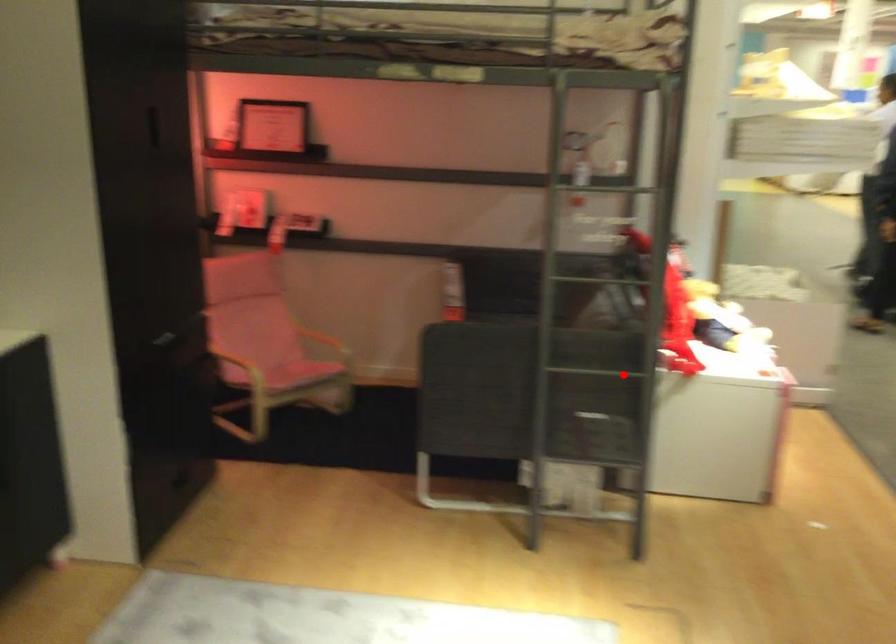
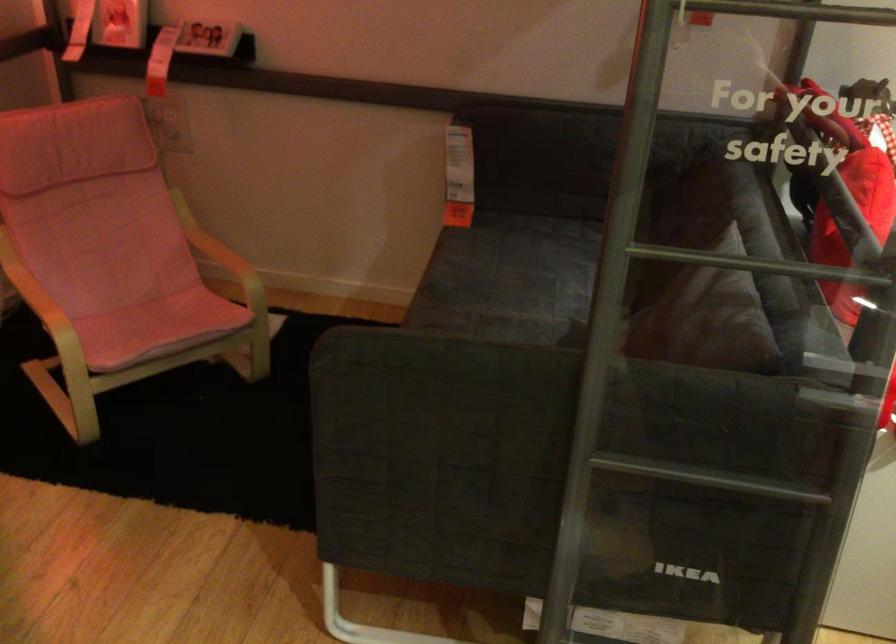
Where in the second image is the point corresponding to the highlighted location from the first image?

(736, 484)